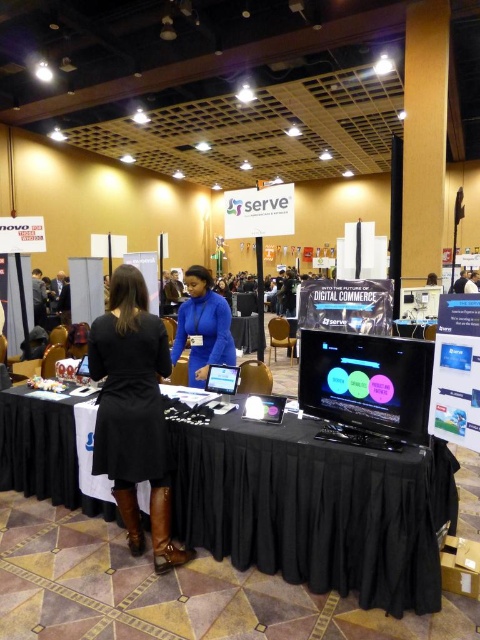
You are a photographer at the event and need to capture a clear shot of both the black fabric table at center and the matte black dress at center. Since both are black, you want to ensure they are distinguishable in the photo. Based on their positions, which object is closer to the camera?

The black fabric table at center is in front of the matte black dress at center, so it is closer to the camera and will appear more prominent in the photo.

You are standing at the serve booth and want to reach both the point at coordinates (452,516) and the point at coordinates (148,474). Which point is closer to you?

The point at coordinates (148,474) is closer to you because it is nearer than the point at coordinates (452,516), which is further away from the camera.

You are setting up a camera to take a photo of the blue matte jacket at center and the black glossy table at center. Which object should you focus on first if you want to capture both clearly in the same frame?

The blue matte jacket at center is located above the black glossy table at center, so you should focus on the black glossy table at center first to ensure both are in focus since it is closer to the camera.